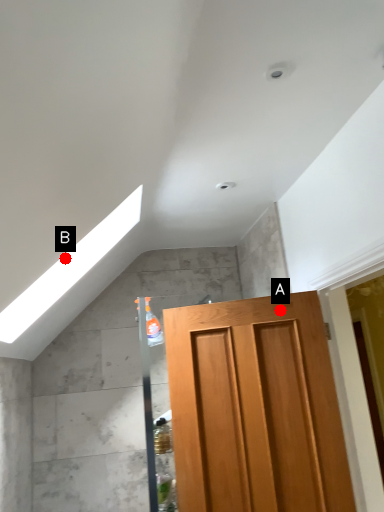
Question: Two points are circled on the image, labeled by A and B beside each circle. Among these points, which one is farthest from the camera?

Choices:
 (A) A is further
 (B) B is further

Answer: (B)